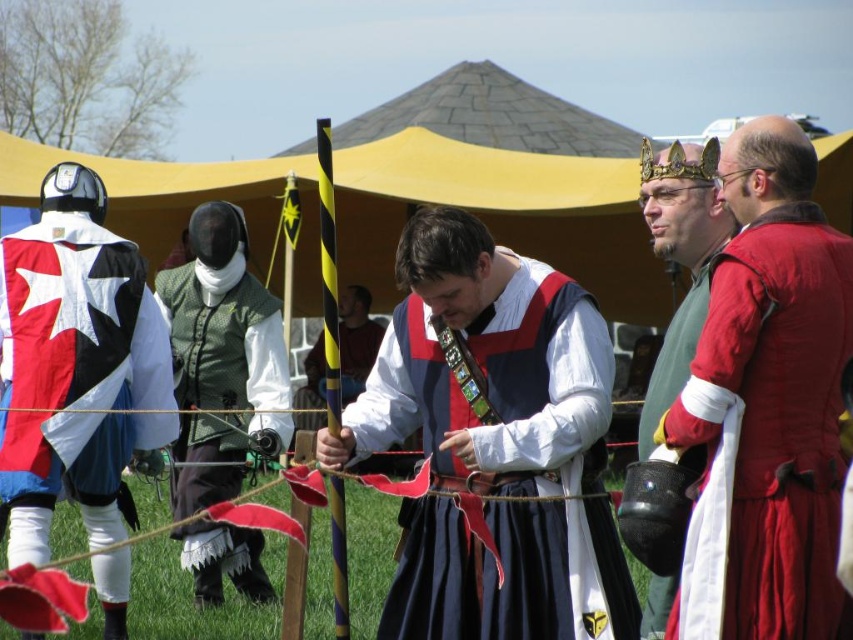
You are a costume designer observing the medieval reenactment scene. You notice two garments of interest. The first is the red velvet tunic at right, and the second is the green textured vest at center. Which garment is covering part of the other?

The red velvet tunic at right is positioned over the green textured vest at center, so it is covering part of it.

You are at the center of the event area and want to move towards the red velvet tunic at right. Based on its position, which direction should you head?

The red velvet tunic at right is located at point 0.675 on the x axis and 0.900 on the y axis. Since you are at the center, you should move towards the right and slightly upwards to reach it.

You are standing at the point closest to the castle structure in this medieval reenactment scene. There are two points marked in the image, one at coordinates point (x=479, y=616) and another at point (x=682, y=170). Which of these points is closer to you?

Point (x=479, y=616) is in front of point (x=682, y=170), so it is closer to you.